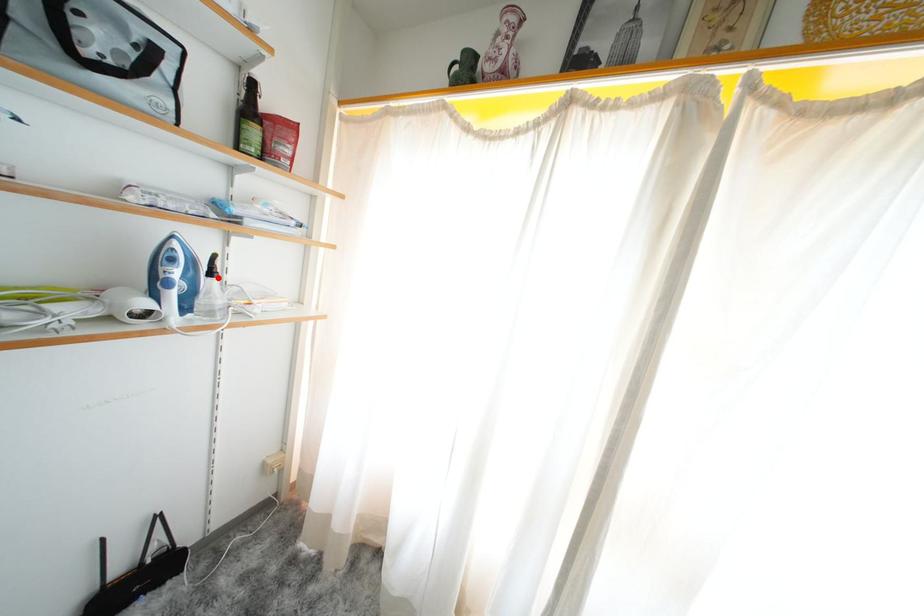
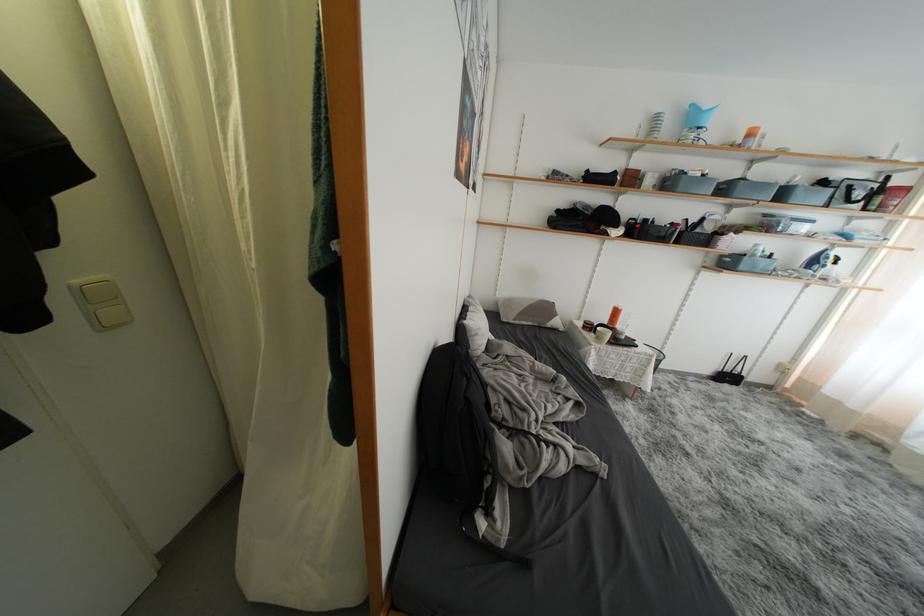
The point at the highlighted location is marked in the first image. Where is the corresponding point in the second image?

(842, 267)